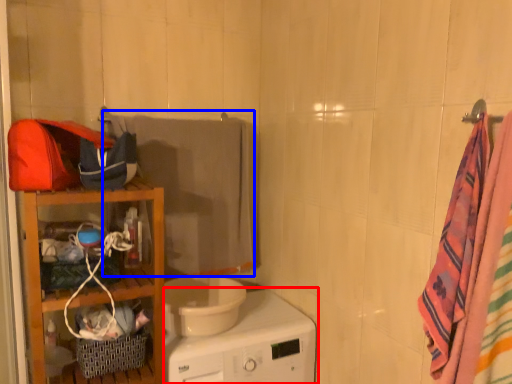
Question: Which of the following is the closest to the observer, home appliance (highlighted by a red box) or beach towel (highlighted by a blue box)?

Choices:
 (A) home appliance
 (B) beach towel

Answer: (A)